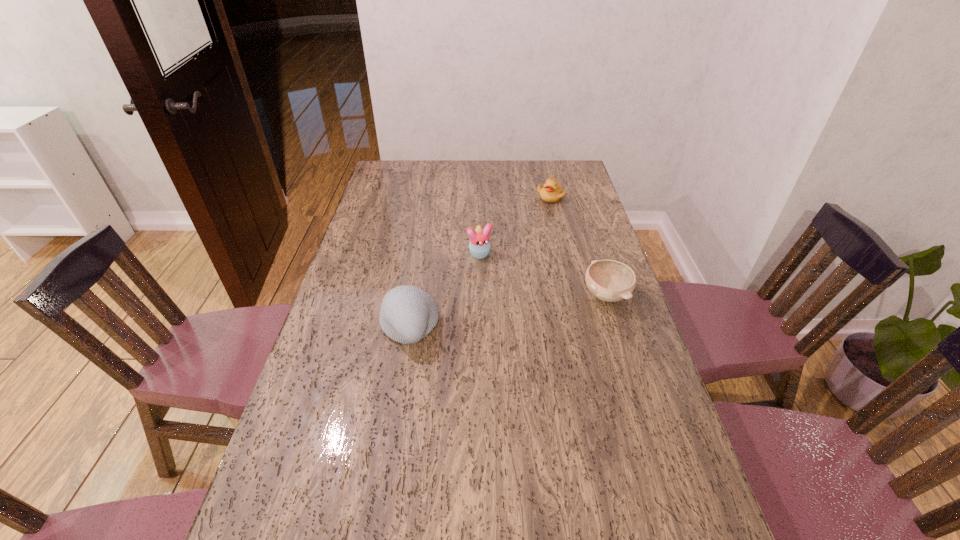
Locate an element on the screen. The height and width of the screenshot is (540, 960). vacant space on the desktop that is between the beanie and the bowl and is positioned on the front-facing side of the duckling is located at coordinates (498, 313).

Find the location of a particular element. The image size is (960, 540). free space on the desktop that is between the beanie and the bowl and is positioned on the face of the cupcake is located at coordinates (507, 311).